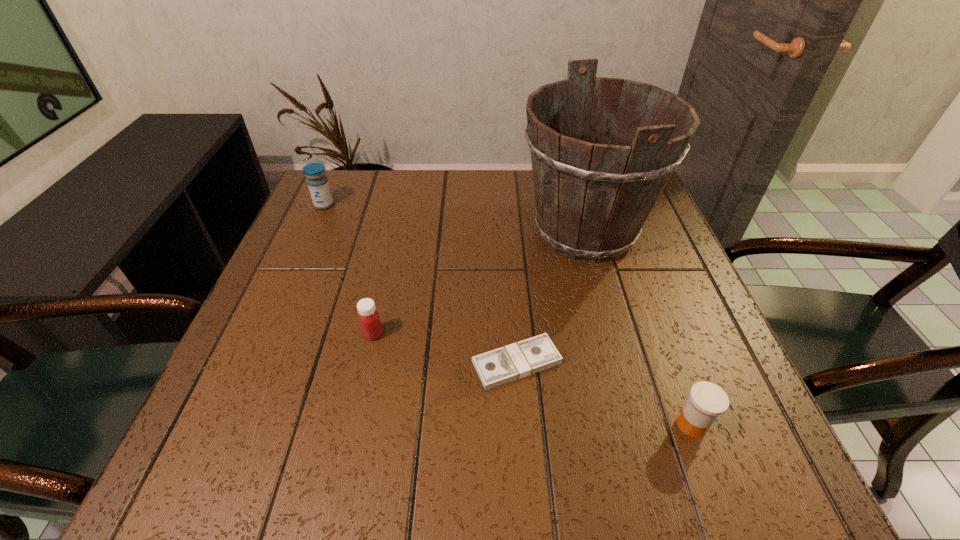
You are a GUI agent. You are given a task and a screenshot of the screen. Output one action in this format:
    pyautogui.click(x=<x>, y=<y>)
    Task: Click on the bucket
    Image resolution: width=960 pixels, height=540 pixels.
    Given the screenshot: What is the action you would take?
    pyautogui.click(x=592, y=199)

This screenshot has height=540, width=960. In order to click on the leftmost medicine in this screenshot , I will do `click(318, 184)`.

You are a GUI agent. You are given a task and a screenshot of the screen. Output one action in this format:
    pyautogui.click(x=<x>, y=<y>)
    Task: Click on the farthest medicine
    This screenshot has width=960, height=540.
    Given the screenshot: What is the action you would take?
    pyautogui.click(x=318, y=184)

Locate an element on the screen. The height and width of the screenshot is (540, 960). the second farthest medicine is located at coordinates (369, 319).

In order to click on the second medicine from left to right in this screenshot , I will do `click(369, 319)`.

The width and height of the screenshot is (960, 540). Find the location of `the nearest medicine`. the nearest medicine is located at coordinates (707, 401).

Find the location of a particular element. the nearest object is located at coordinates (707, 401).

Where is `dollar`? Image resolution: width=960 pixels, height=540 pixels. dollar is located at coordinates (500, 366).

I want to click on free space located on the left of the bucket, so click(x=428, y=231).

This screenshot has height=540, width=960. In order to click on vacant region located on the right of the fourth shortest object in this screenshot , I will do `click(369, 205)`.